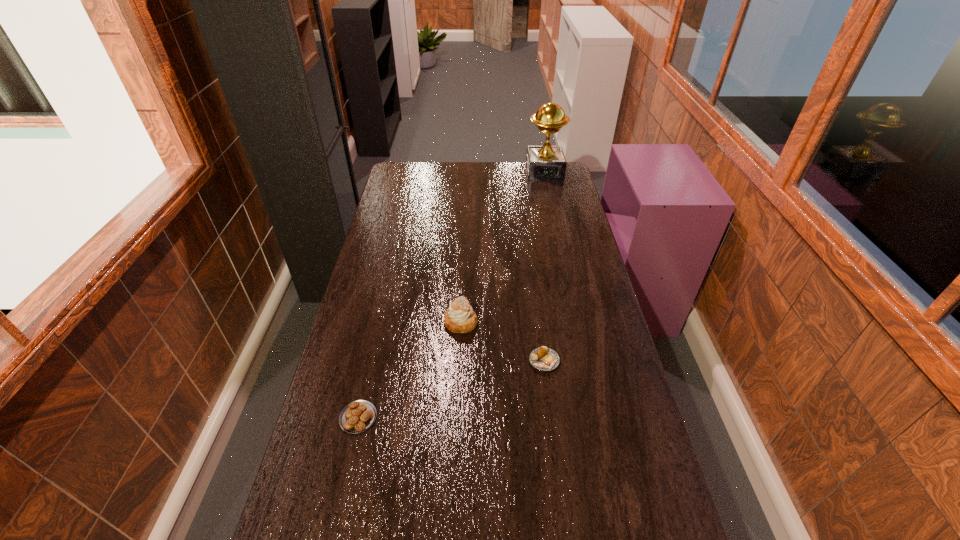
This screenshot has height=540, width=960. Identify the location of object that is the closest to the nearest pastry. (460, 318).

Point out which object is positioned as the third nearest to the second pastry from left to right. Please provide its 2D coordinates. Your answer should be formatted as a tuple, i.e. [(x, y)], where the tuple contains the x and y coordinates of a point satisfying the conditions above.

[(546, 162)]

Select which pastry appears as the closest to the farthest object. Please provide its 2D coordinates. Your answer should be formatted as a tuple, i.e. [(x, y)], where the tuple contains the x and y coordinates of a point satisfying the conditions above.

[(460, 318)]

Identify the location of pastry identified as the third closest to the tallest object. (358, 416).

Locate an element on the screen. The width and height of the screenshot is (960, 540). free spot that satisfies the following two spatial constraints: 1. on the front side of the second shortest pastry; 2. on the left side of the second tallest object is located at coordinates (459, 361).